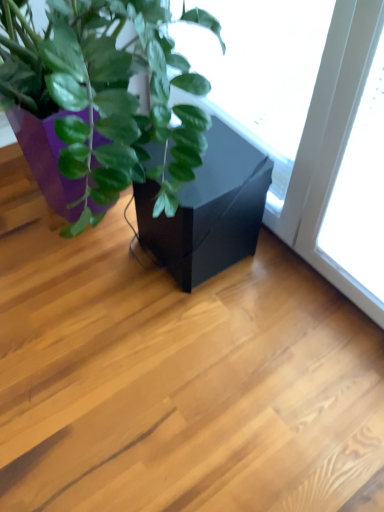
The height and width of the screenshot is (512, 384). Describe the element at coordinates (209, 210) in the screenshot. I see `black matte flowerpot at center` at that location.

This screenshot has height=512, width=384. What are the coordinates of `black matte flowerpot at center` in the screenshot? It's located at (209, 210).

You are a GUI agent. You are given a task and a screenshot of the screen. Output one action in this format:
    pyautogui.click(x=<x>, y=<y>)
    Task: Click on the black matte flowerpot at center
    The width and height of the screenshot is (384, 512).
    Given the screenshot: What is the action you would take?
    pyautogui.click(x=209, y=210)